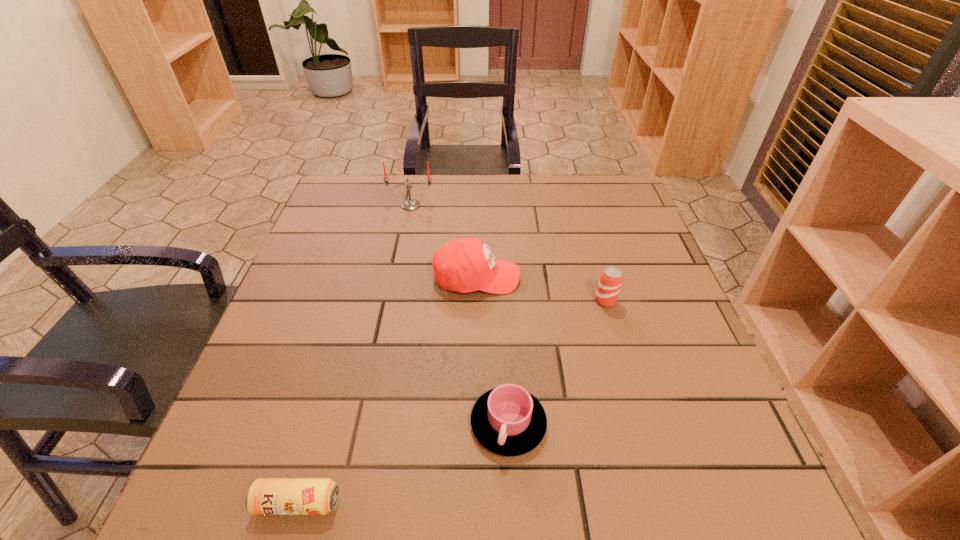
You are a GUI agent. You are given a task and a screenshot of the screen. Output one action in this format:
    pyautogui.click(x=<x>, y=<y>)
    Task: Click on the free space at the near edge of the desktop
    Image resolution: width=960 pixels, height=540 pixels.
    Given the screenshot: What is the action you would take?
    click(616, 474)

Where is `vacant region at the left edge of the desktop`? This screenshot has width=960, height=540. vacant region at the left edge of the desktop is located at coordinates 348,284.

Where is `free space at the right edge`? The image size is (960, 540). free space at the right edge is located at coordinates (676, 345).

Image resolution: width=960 pixels, height=540 pixels. Find the location of `free point at the far right corner`. free point at the far right corner is located at coordinates (612, 191).

Locate an element on the screen. Image resolution: width=960 pixels, height=540 pixels. free space that is in between the third tallest object and the tallest object is located at coordinates (508, 253).

Locate an element on the screen. This screenshot has width=960, height=540. vacant area that lies between the right beer can and the farthest object is located at coordinates (508, 253).

You are a GUI agent. You are given a task and a screenshot of the screen. Output one action in this format:
    pyautogui.click(x=<x>, y=<y>)
    Task: Click on the free space between the tallest object and the third tallest object
    
    Given the screenshot: What is the action you would take?
    pyautogui.click(x=508, y=253)

Where is `free point between the second shortest object and the farther beer can`? This screenshot has height=540, width=960. free point between the second shortest object and the farther beer can is located at coordinates (557, 362).

This screenshot has width=960, height=540. What are the coordinates of `free space that is in between the nearer beer can and the baseball cap` in the screenshot? It's located at (387, 390).

Image resolution: width=960 pixels, height=540 pixels. I want to click on free space that is in between the baseball cap and the farther beer can, so click(x=541, y=289).